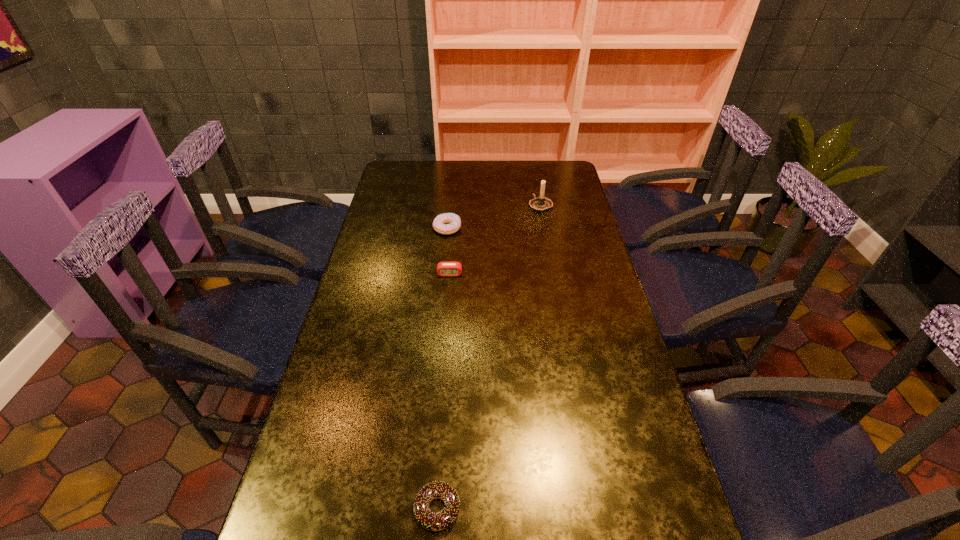
Identify the location of the farthest object. This screenshot has height=540, width=960. (540, 204).

Locate an element on the screen. The height and width of the screenshot is (540, 960). the rightmost object is located at coordinates (540, 204).

Identify the location of the taller doughnut. (439, 222).

You are a GUI agent. You are given a task and a screenshot of the screen. Output one action in this format:
    pyautogui.click(x=<x>, y=<y>)
    Task: Click on the farther doughnut
    The image size is (960, 540).
    Given the screenshot: What is the action you would take?
    pyautogui.click(x=439, y=222)

Locate an element on the screen. the second nearest object is located at coordinates (448, 269).

Locate an element on the screen. the nearest object is located at coordinates (431, 521).

Locate an element on the screen. This screenshot has width=960, height=540. the shortest object is located at coordinates (431, 521).

This screenshot has width=960, height=540. I want to click on vacant space located on the left of the rightmost object, so [444, 205].

I want to click on free point located 0.170m on the right of the taller doughnut, so click(x=506, y=228).

Image resolution: width=960 pixels, height=540 pixels. I want to click on vacant region located on the front-facing side of the second nearest object, so click(x=444, y=351).